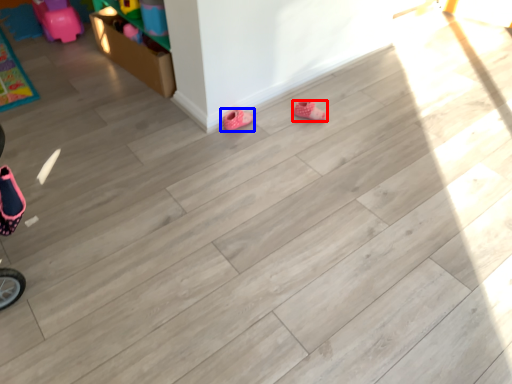
Question: Which object is closer to the camera taking this photo, footwear (highlighted by a red box) or footwear (highlighted by a blue box)?

Choices:
 (A) footwear
 (B) footwear

Answer: (B)